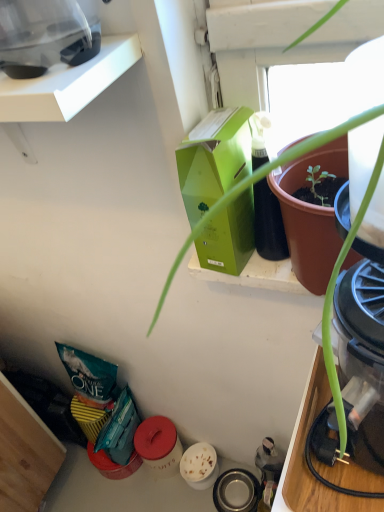
Question: From a real-world perspective, is metallic stainless steel bowl at lower center, which appears as the first appliance when viewed from the back, positioned above or below transparent plastic blender at upper left, which ranks as the second appliance in back-to-front order?

Choices:
 (A) below
 (B) above

Answer: (A)

Question: From the image's perspective, is metallic stainless steel bowl at lower center, which appears as the first appliance when viewed from the back, above or below transparent plastic blender at upper left, the first appliance from the top?

Choices:
 (A) above
 (B) below

Answer: (B)

Question: Which object is positioned farthest from the transparent plastic blender at upper left, placed as the 1th appliance when sorted from left to right?

Choices:
 (A) green matte box at upper center
 (B) metallic stainless steel bowl at lower center, which appears as the first appliance when viewed from the back

Answer: (B)

Question: Which object is positioned farthest from the transparent plastic blender at upper left, placed as the 1th appliance when sorted from left to right?

Choices:
 (A) metallic stainless steel bowl at lower center, arranged as the first appliance when viewed from the right
 (B) green matte box at upper center

Answer: (A)